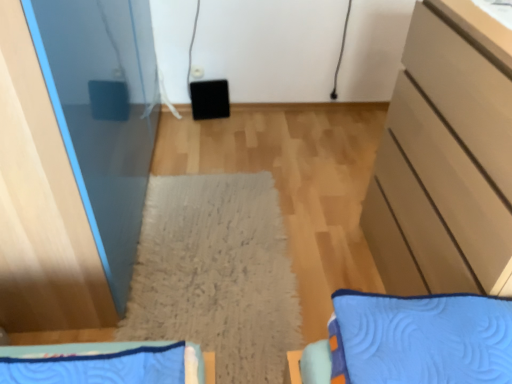
Question: Is matte beige cabinet at right looking in the opposite direction of blue quilted bedspread at lower left?

Choices:
 (A) no
 (B) yes

Answer: (A)

Question: Is the depth of matte beige cabinet at right greater than that of blue quilted bedspread at lower left?

Choices:
 (A) no
 (B) yes

Answer: (B)

Question: Does matte beige cabinet at right appear on the right side of blue quilted bedspread at lower left?

Choices:
 (A) no
 (B) yes

Answer: (B)

Question: Is matte beige cabinet at right smaller than blue quilted bedspread at lower left?

Choices:
 (A) no
 (B) yes

Answer: (A)

Question: From the image's perspective, would you say matte beige cabinet at right is positioned over blue quilted bedspread at lower left?

Choices:
 (A) no
 (B) yes

Answer: (B)

Question: Considering the positions of point (414, 254) and point (165, 261), is point (414, 254) closer or farther from the camera than point (165, 261)?

Choices:
 (A) farther
 (B) closer

Answer: (B)

Question: Is matte beige cabinet at right situated inside beige textured mat at center or outside?

Choices:
 (A) outside
 (B) inside

Answer: (A)

Question: Considering their positions, is matte beige cabinet at right located in front of or behind beige textured mat at center?

Choices:
 (A) front
 (B) behind

Answer: (A)

Question: From their relative heights in the image, would you say matte beige cabinet at right is taller or shorter than beige textured mat at center?

Choices:
 (A) tall
 (B) short

Answer: (A)

Question: In terms of width, does beige textured mat at center look wider or thinner when compared to blue quilted bedspread at lower left?

Choices:
 (A) wide
 (B) thin

Answer: (A)

Question: From a real-world perspective, is beige textured mat at center above or below blue quilted bedspread at lower left?

Choices:
 (A) above
 (B) below

Answer: (B)

Question: Relative to blue quilted bedspread at lower left, is beige textured mat at center in front or behind?

Choices:
 (A) front
 (B) behind

Answer: (B)

Question: From the image's perspective, is beige textured mat at center located above or below blue quilted bedspread at lower left?

Choices:
 (A) below
 (B) above

Answer: (B)

Question: Is blue quilted bedspread at lower left situated inside matte beige cabinet at right or outside?

Choices:
 (A) inside
 (B) outside

Answer: (B)

Question: From a real-world perspective, is blue quilted bedspread at lower left positioned above or below matte beige cabinet at right?

Choices:
 (A) below
 (B) above

Answer: (B)